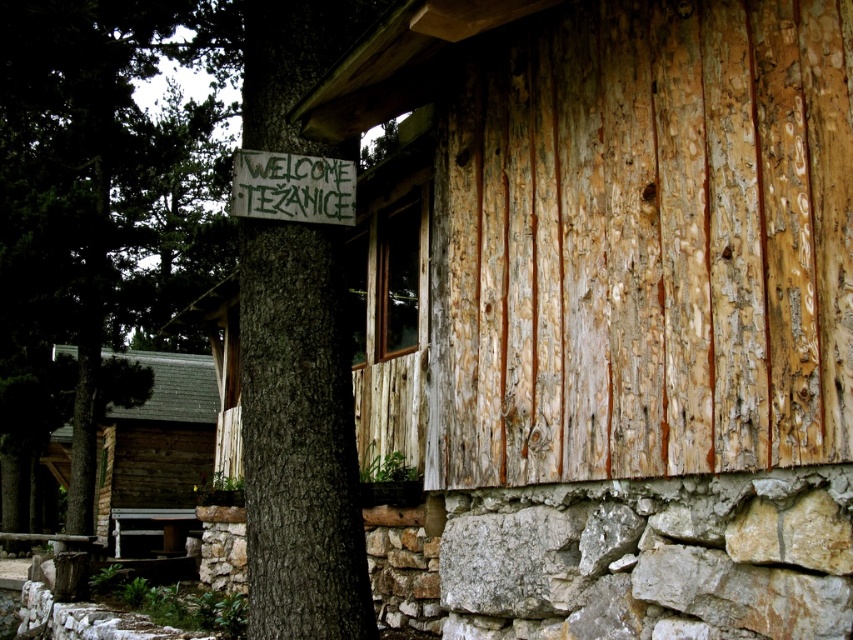
Question: Which point is closer to the camera taking this photo?

Choices:
 (A) (103, 529)
 (B) (315, 324)
 (C) (309, 157)

Answer: (B)

Question: In this image, where is green rough bark tree at left located relative to brown rough bark tree at left?

Choices:
 (A) left
 (B) right

Answer: (A)

Question: Among these objects, which one is farthest from the camera?

Choices:
 (A) green painted wood sign at upper center
 (B) brown rough bark tree at left

Answer: (A)

Question: Is green rough bark tree at left further to the viewer compared to brown rough bark tree at left?

Choices:
 (A) no
 (B) yes

Answer: (B)

Question: Which of these objects is positioned farthest from the brown wooden log cabin at left?

Choices:
 (A) brown rough bark tree at left
 (B) green rough bark tree at left

Answer: (A)

Question: Can you confirm if green rough bark tree at left is positioned to the right of brown wooden log cabin at left?

Choices:
 (A) no
 (B) yes

Answer: (B)